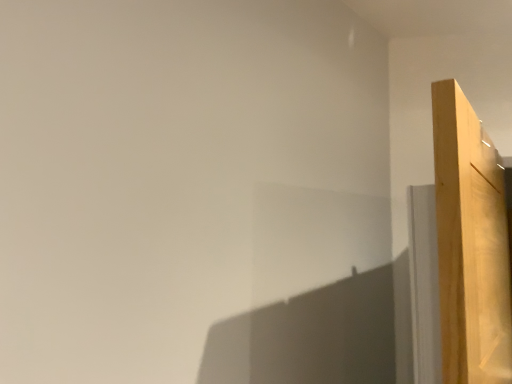
Question: Should I look upward or downward to see light wood door at right?

Choices:
 (A) up
 (B) down

Answer: (B)